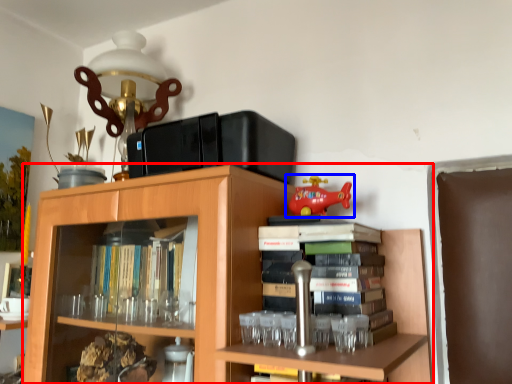
Question: Which point is further to the camera, bookcase (highlighted by a red box) or toy (highlighted by a blue box)?

Choices:
 (A) bookcase
 (B) toy

Answer: (B)